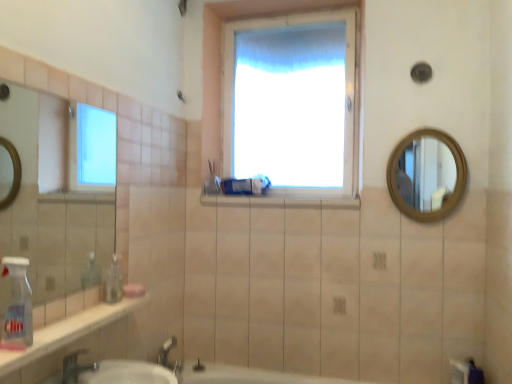
Question: From a real-world perspective, is wooden round mirror at upper right located higher than white glossy window sill at center?

Choices:
 (A) yes
 (B) no

Answer: (A)

Question: From a real-world perspective, is wooden round mirror at upper right below white glossy window sill at center?

Choices:
 (A) no
 (B) yes

Answer: (A)

Question: Would you consider wooden round mirror at upper right to be distant from white glossy window sill at center?

Choices:
 (A) no
 (B) yes

Answer: (A)

Question: Is wooden round mirror at upper right positioned with its back to white glossy window sill at center?

Choices:
 (A) no
 (B) yes

Answer: (A)

Question: Does wooden round mirror at upper right come in front of white glossy window sill at center?

Choices:
 (A) no
 (B) yes

Answer: (B)

Question: From the image's perspective, does wooden round mirror at upper right appear higher than white glossy window sill at center?

Choices:
 (A) no
 (B) yes

Answer: (B)

Question: Are pink matte soap at lower left and matte plastic toothbrush at center located far from each other?

Choices:
 (A) yes
 (B) no

Answer: (B)

Question: Does pink matte soap at lower left touch matte plastic toothbrush at center?

Choices:
 (A) no
 (B) yes

Answer: (A)

Question: Can you confirm if pink matte soap at lower left is thinner than matte plastic toothbrush at center?

Choices:
 (A) yes
 (B) no

Answer: (B)

Question: From a real-world perspective, does pink matte soap at lower left sit lower than matte plastic toothbrush at center?

Choices:
 (A) no
 (B) yes

Answer: (B)

Question: Is pink matte soap at lower left bigger than matte plastic toothbrush at center?

Choices:
 (A) yes
 (B) no

Answer: (B)

Question: Is pink matte soap at lower left facing towards matte plastic toothbrush at center?

Choices:
 (A) yes
 (B) no

Answer: (B)

Question: Could you tell me if white glossy window sill at center is turned towards matte plastic toothbrush at center?

Choices:
 (A) no
 (B) yes

Answer: (A)